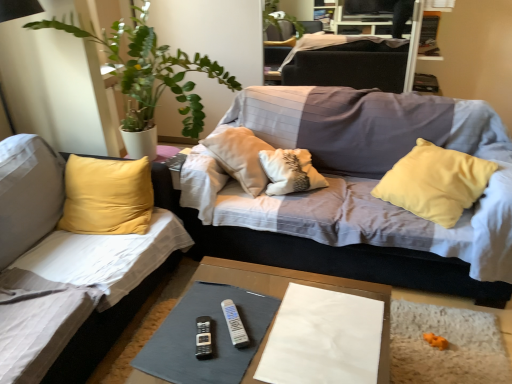
The width and height of the screenshot is (512, 384). In order to click on free space above smooth gray fabric at center (from a real-world perspective) in this screenshot , I will do `click(279, 329)`.